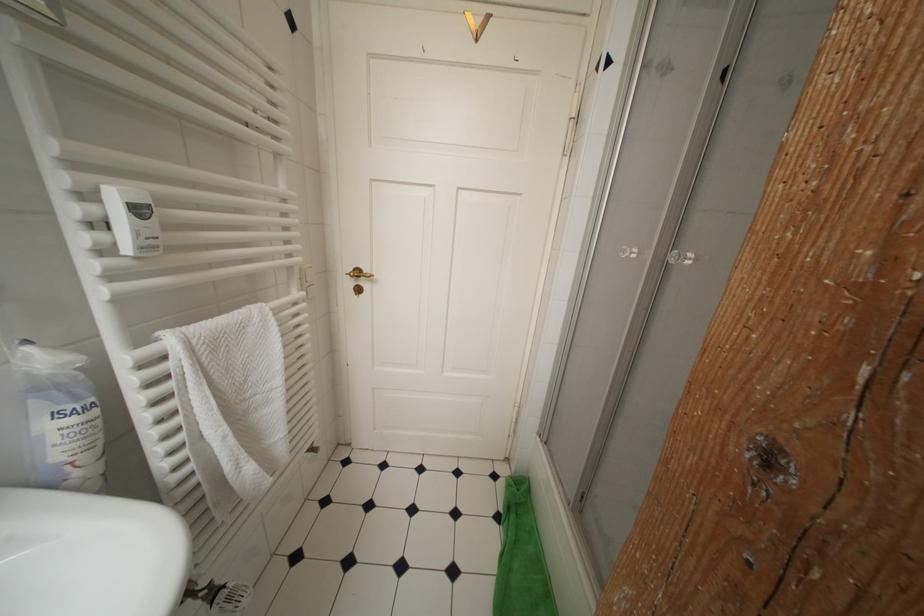
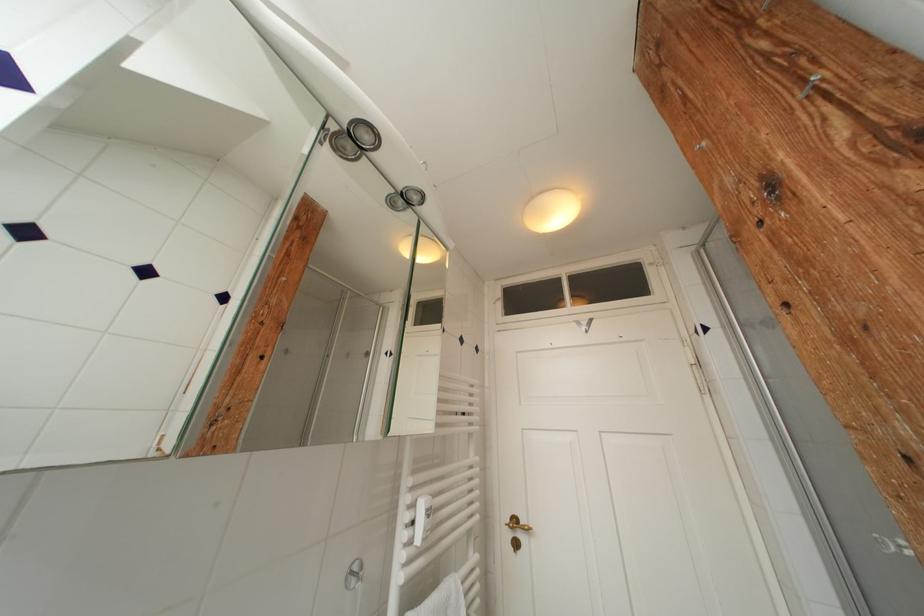
Find the pixel in the second image that matches point (365, 276) in the first image.

(521, 525)